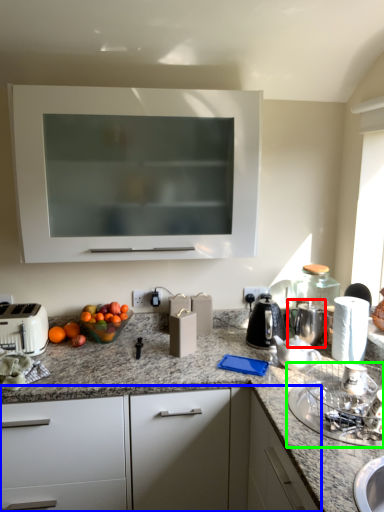
Question: Based on their relative distances, which object is nearer to coffeepot (highlighted by a red box)? Choose from cabinetry (highlighted by a blue box) and appliance (highlighted by a green box).

Choices:
 (A) cabinetry
 (B) appliance

Answer: (B)